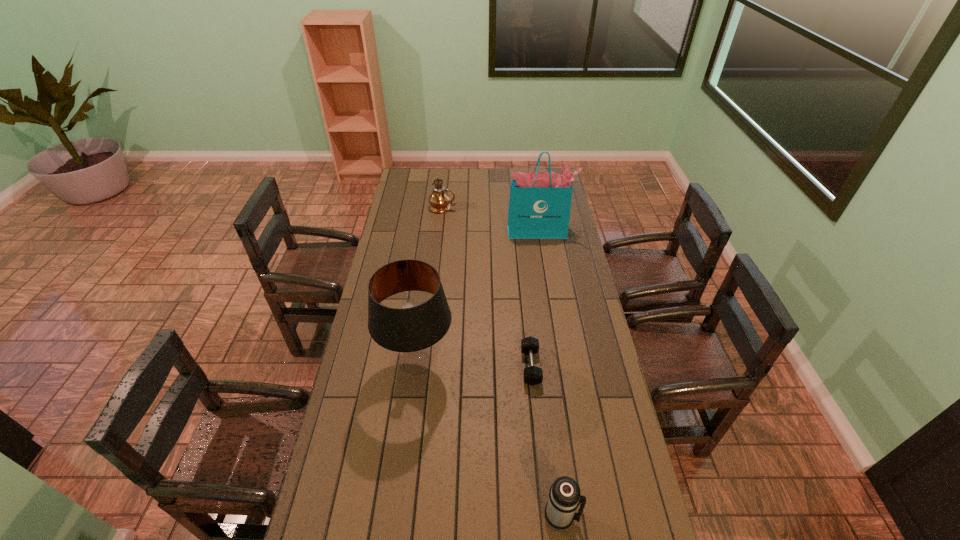
This screenshot has height=540, width=960. In order to click on the fourth nearest object in this screenshot , I will do `click(540, 202)`.

Locate an element on the screen. The width and height of the screenshot is (960, 540). lampshade is located at coordinates [x=412, y=338].

Where is `the farthest object`? The image size is (960, 540). the farthest object is located at coordinates (439, 200).

Where is `oil lamp`? This screenshot has width=960, height=540. oil lamp is located at coordinates (439, 200).

The image size is (960, 540). In order to click on the second shortest object in this screenshot , I will do `click(564, 496)`.

The image size is (960, 540). Identify the location of thermos bottle. (564, 496).

This screenshot has height=540, width=960. I want to click on the shortest object, so click(533, 375).

This screenshot has height=540, width=960. What are the coordinates of `free space located 0.110m on the left of the fourth nearest object` in the screenshot? It's located at (486, 231).

The width and height of the screenshot is (960, 540). I want to click on vacant space located on the front of the lampshade, so click(397, 521).

This screenshot has width=960, height=540. Find the location of `free space located 0.170m on the right of the oil lamp`. free space located 0.170m on the right of the oil lamp is located at coordinates (490, 207).